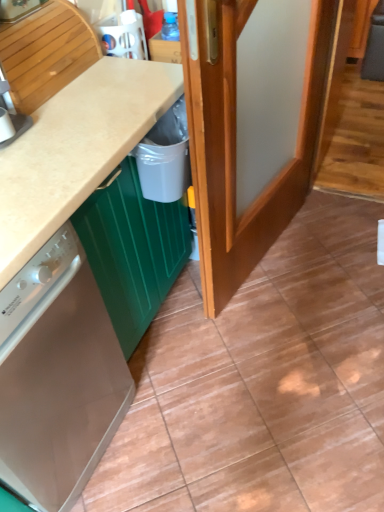
Question: Does point (39, 2) appear closer or farther from the camera than point (147, 195)?

Choices:
 (A) closer
 (B) farther

Answer: (A)

Question: From a real-world perspective, is brushed metal dishwasher at left positioned above or below white plastic bin at lower center?

Choices:
 (A) below
 (B) above

Answer: (B)

Question: Which of these objects is positioned farthest from the white plastic bin at lower center?

Choices:
 (A) brushed metal dishwasher at left
 (B) beige matte countertop at center
 (C) satin white dishwasher at lower left
 (D) wooden door at center

Answer: (C)

Question: Estimate the real-world distances between objects in this image. Which object is farther from the brushed metal dishwasher at left?

Choices:
 (A) wooden door at center
 (B) satin white dishwasher at lower left
 (C) beige matte countertop at center
 (D) white plastic bin at lower center

Answer: (B)